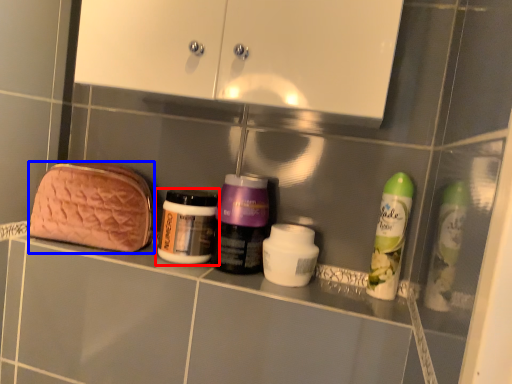
Question: Which of the following is the farthest to the observer, bottle (highlighted by a red box) or pouch (highlighted by a blue box)?

Choices:
 (A) bottle
 (B) pouch

Answer: (B)